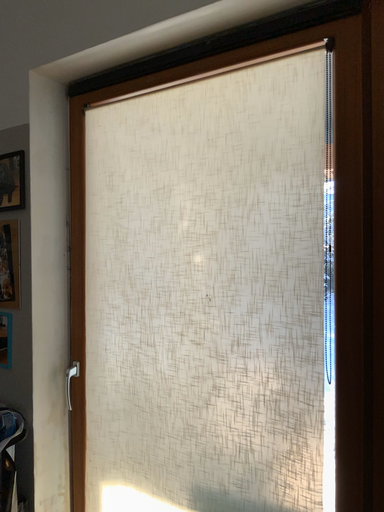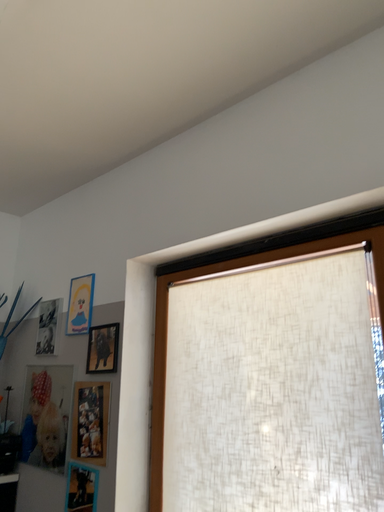
Question: Which way did the camera rotate in the video?

Choices:
 (A) rotated downward
 (B) rotated upward

Answer: (B)